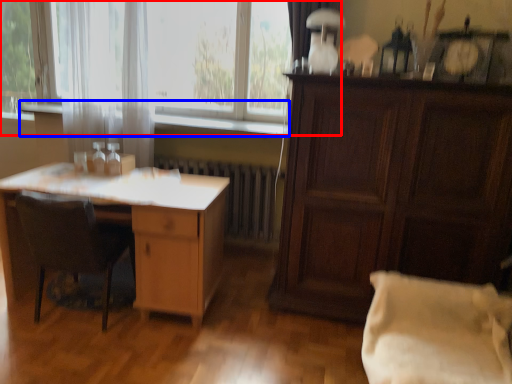
Question: Which object is closer to the camera taking this photo, window (highlighted by a red box) or window sill (highlighted by a blue box)?

Choices:
 (A) window
 (B) window sill

Answer: (B)